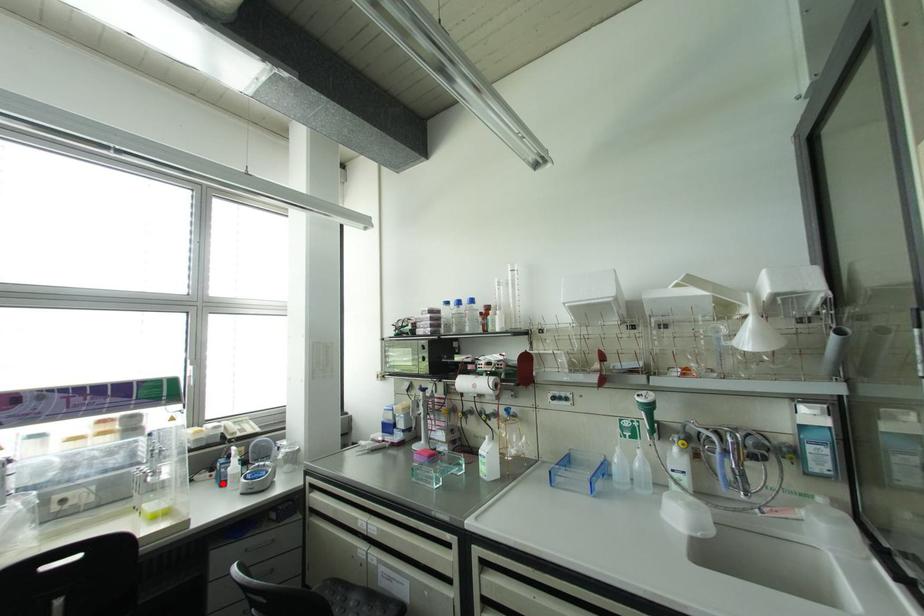
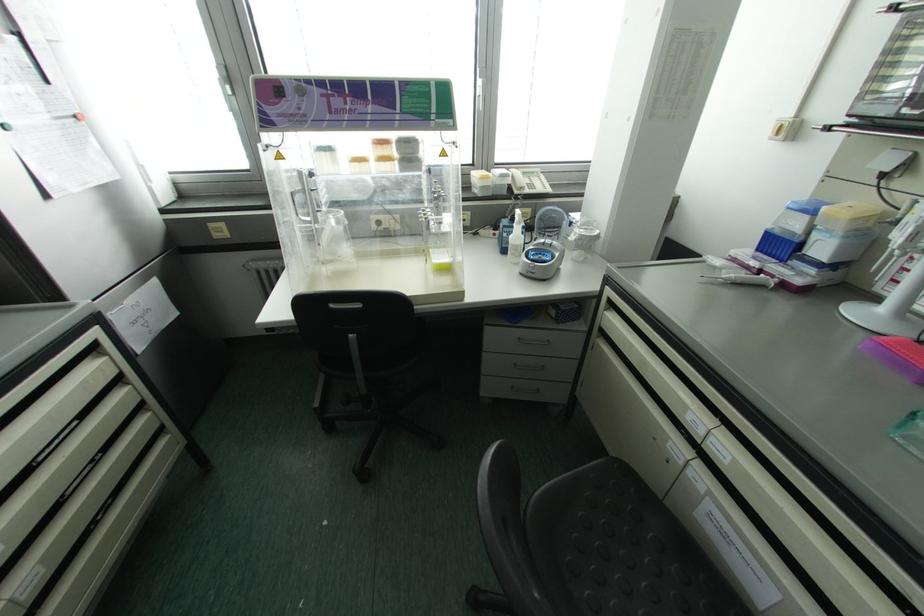
In the second image, find the point that corresponds to the highlighted location in the first image.

(504, 251)